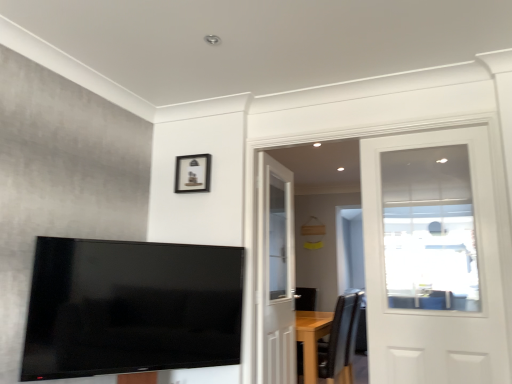
Question: From a real-world perspective, is white glossy door at upper right, the second door when ordered from left to right, positioned under black leather chair at lower right based on gravity?

Choices:
 (A) yes
 (B) no

Answer: (B)

Question: From the image's perspective, is white glossy door at upper right, positioned as the first door in right-to-left order, above black leather chair at lower right?

Choices:
 (A) no
 (B) yes

Answer: (B)

Question: Does white glossy door at upper right, which is the 1th door from front to back, contain black leather chair at lower right?

Choices:
 (A) yes
 (B) no

Answer: (B)

Question: Is white glossy door at upper right, the second door when ordered from left to right, closer to the viewer compared to black leather chair at lower right?

Choices:
 (A) yes
 (B) no

Answer: (A)

Question: Is the position of white glossy door at upper right, positioned as the first door in right-to-left order, more distant than that of black leather chair at lower right?

Choices:
 (A) yes
 (B) no

Answer: (B)

Question: Considering the relative sizes of white glossy door at upper right, which is the 1th door from front to back, and black leather chair at lower right in the image provided, is white glossy door at upper right, which is the 1th door from front to back, shorter than black leather chair at lower right?

Choices:
 (A) yes
 (B) no

Answer: (B)

Question: Considering the relative sizes of white wooden door at center, positioned as the 2th door in front-to-back order, and black leather chair at lower right in the image provided, is white wooden door at center, positioned as the 2th door in front-to-back order, smaller than black leather chair at lower right?

Choices:
 (A) no
 (B) yes

Answer: (B)

Question: Does white wooden door at center, which is counted as the first door, starting from the left, touch black leather chair at lower right?

Choices:
 (A) no
 (B) yes

Answer: (A)

Question: From a real-world perspective, is white wooden door at center, the 2th door in the right-to-left sequence, over black leather chair at lower right?

Choices:
 (A) no
 (B) yes

Answer: (B)

Question: Is white wooden door at center, positioned as the 2th door in front-to-back order, aimed at black leather chair at lower right?

Choices:
 (A) yes
 (B) no

Answer: (B)

Question: Is white wooden door at center, positioned as the 2th door in front-to-back order, closer to the viewer compared to black leather chair at lower right?

Choices:
 (A) no
 (B) yes

Answer: (B)

Question: Would you say white wooden door at center, positioned as the 2th door in front-to-back order, is outside black leather chair at lower right?

Choices:
 (A) yes
 (B) no

Answer: (A)

Question: From the image's perspective, is black leather chair at lower right located beneath matte black picture frame at upper center?

Choices:
 (A) no
 (B) yes

Answer: (B)